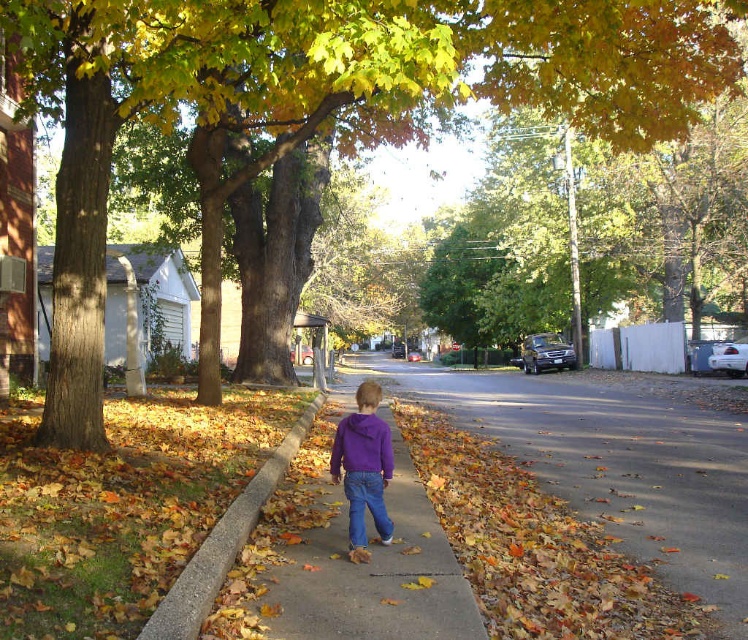
Is green leafy tree at center to the right of brown asphalt road at center from the viewer's perspective?

No, green leafy tree at center is not to the right of brown asphalt road at center.

From the picture: Does green leafy tree at center appear over brown asphalt road at center?

Yes, green leafy tree at center is above brown asphalt road at center.

Where is `green leafy tree at center`? green leafy tree at center is located at coordinates (319, 108).

Measure the distance between point (603, 448) and camera.

Point (603, 448) is 11.26 meters from camera.

Between brown asphalt road at center and purple fleece jacket at center, which one is positioned lower?

Positioned lower is brown asphalt road at center.

Locate an element on the screen. The width and height of the screenshot is (748, 640). brown asphalt road at center is located at coordinates (x=610, y=461).

Is concrete at lower left wider than purple fleece jacket at center?

No, concrete at lower left is not wider than purple fleece jacket at center.

Describe the element at coordinates (223, 544) in the screenshot. This screenshot has height=640, width=748. I see `concrete at lower left` at that location.

Identify the location of concrete at lower left. The image size is (748, 640). (223, 544).